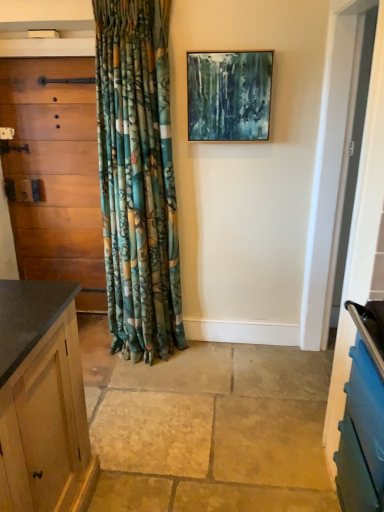
What do you see at coordinates (54, 174) in the screenshot?
I see `wooden cabinet at left` at bounding box center [54, 174].

In order to click on wooden cabinet at left in this screenshot , I will do `click(54, 174)`.

What do you see at coordinates (229, 95) in the screenshot?
I see `metallic gold picture frame at upper center` at bounding box center [229, 95].

Identify the location of metallic gold picture frame at upper center. (229, 95).

Where is `wooden cabinet at left`? Image resolution: width=384 pixels, height=512 pixels. wooden cabinet at left is located at coordinates (54, 174).

Is wooden cabinet at left to the right of metallic gold picture frame at upper center from the viewer's perspective?

No.

Is wooden cabinet at left in front of or behind metallic gold picture frame at upper center in the image?

wooden cabinet at left is behind metallic gold picture frame at upper center.

Which is further, (28, 200) or (229, 111)?

The point (28, 200) is behind.

From the image's perspective, does wooden cabinet at left appear lower than metallic gold picture frame at upper center?

Yes, from the image's perspective, wooden cabinet at left is below metallic gold picture frame at upper center.

From a real-world perspective, is wooden cabinet at left under metallic gold picture frame at upper center?

Correct, in the physical world, wooden cabinet at left is lower than metallic gold picture frame at upper center.

Does wooden cabinet at left have a greater width compared to metallic gold picture frame at upper center?

Correct, the width of wooden cabinet at left exceeds that of metallic gold picture frame at upper center.

Between wooden cabinet at left and metallic gold picture frame at upper center, which one has more height?

wooden cabinet at left.

Does wooden cabinet at left have a larger size compared to metallic gold picture frame at upper center?

Yes.

Is wooden cabinet at left inside or outside of metallic gold picture frame at upper center?

wooden cabinet at left cannot be found inside metallic gold picture frame at upper center.

Is the surface of wooden cabinet at left in direct contact with metallic gold picture frame at upper center?

No, wooden cabinet at left is not touching metallic gold picture frame at upper center.

Is wooden cabinet at left looking in the opposite direction of metallic gold picture frame at upper center?

No, wooden cabinet at left's orientation is not away from metallic gold picture frame at upper center.

How different are the orientations of wooden cabinet at left and metallic gold picture frame at upper center in degrees?

The angle between the facing direction of wooden cabinet at left and the facing direction of metallic gold picture frame at upper center is 0.711 degrees.

In the scene shown: Measure the distance between wooden cabinet at left and metallic gold picture frame at upper center.

They are 1.07 meters apart.

The width and height of the screenshot is (384, 512). Identify the location of picture frame that is on the right side of wooden cabinet at left. (229, 95).

Would you say metallic gold picture frame at upper center is to the left or to the right of wooden cabinet at left in the picture?

Based on their positions, metallic gold picture frame at upper center is located to the right of wooden cabinet at left.

Which object is more forward, metallic gold picture frame at upper center or wooden cabinet at left?

metallic gold picture frame at upper center.

Does point (259, 93) come closer to viewer compared to point (47, 234)?

Yes.

From the image's perspective, who appears lower, metallic gold picture frame at upper center or wooden cabinet at left?

From the image's view, wooden cabinet at left is below.

From a real-world perspective, which is physically below, metallic gold picture frame at upper center or wooden cabinet at left?

wooden cabinet at left.

Which of these two, metallic gold picture frame at upper center or wooden cabinet at left, is thinner?

Thinner between the two is metallic gold picture frame at upper center.

Between metallic gold picture frame at upper center and wooden cabinet at left, which one has less height?

Standing shorter between the two is metallic gold picture frame at upper center.

Between metallic gold picture frame at upper center and wooden cabinet at left, which one has larger size?

With larger size is wooden cabinet at left.

Does metallic gold picture frame at upper center contain wooden cabinet at left?

That's incorrect, wooden cabinet at left is not inside metallic gold picture frame at upper center.

Is metallic gold picture frame at upper center touching wooden cabinet at left?

No, metallic gold picture frame at upper center is not beside wooden cabinet at left.

Is wooden cabinet at left at the back of metallic gold picture frame at upper center?

No, metallic gold picture frame at upper center is not facing the opposite direction of wooden cabinet at left.

Find the location of a particular element. picture frame that is on the right side of wooden cabinet at left is located at coordinates (229, 95).

Where is `chest of drawers behind the metallic gold picture frame at upper center`? The image size is (384, 512). chest of drawers behind the metallic gold picture frame at upper center is located at coordinates click(x=54, y=174).

You are a GUI agent. You are given a task and a screenshot of the screen. Output one action in this format:
    pyautogui.click(x=<x>, y=<y>)
    Task: Click on the chest of drawers located underneath the metallic gold picture frame at upper center (from a real-world perspective)
    
    Given the screenshot: What is the action you would take?
    pyautogui.click(x=54, y=174)